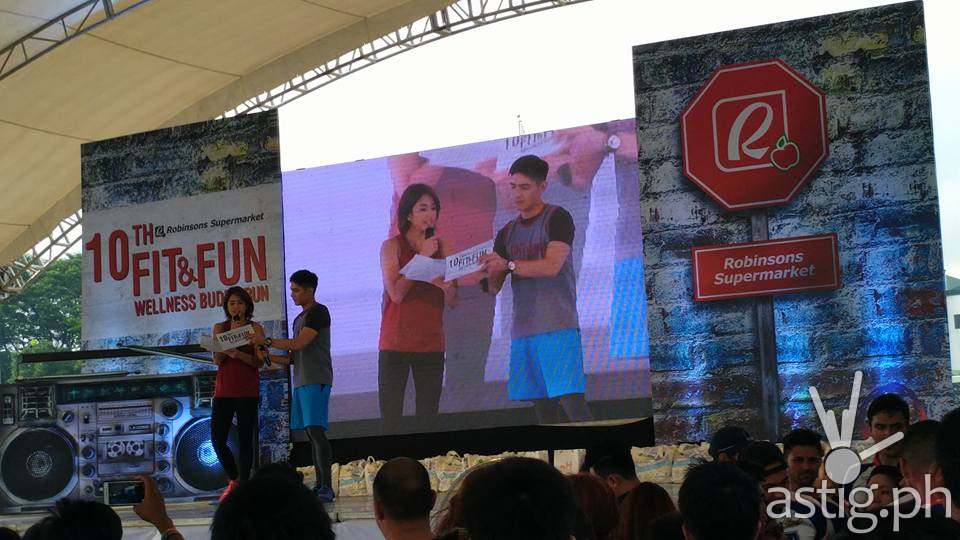
Locate an element on the screen. The image size is (960, 540). video screen is located at coordinates (483, 194).